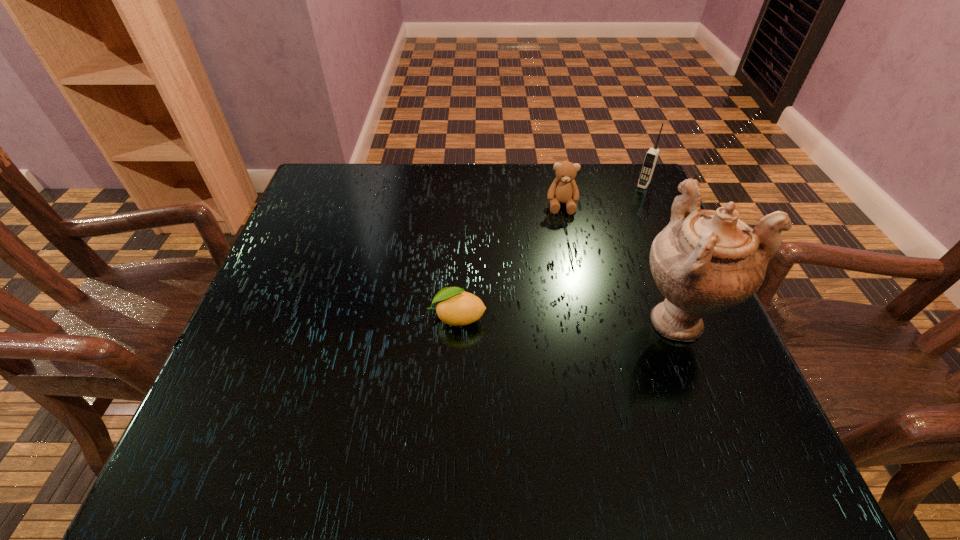
Identify the location of vacant space on the desktop that is between the lemon and the tallest object and is positioned on the front-facing side of the farthest object. The width and height of the screenshot is (960, 540). (551, 318).

Locate an element on the screen. vacant space on the desktop that is between the leftmost object and the tallest object and is positioned on the front-facing side of the teddy bear is located at coordinates (568, 318).